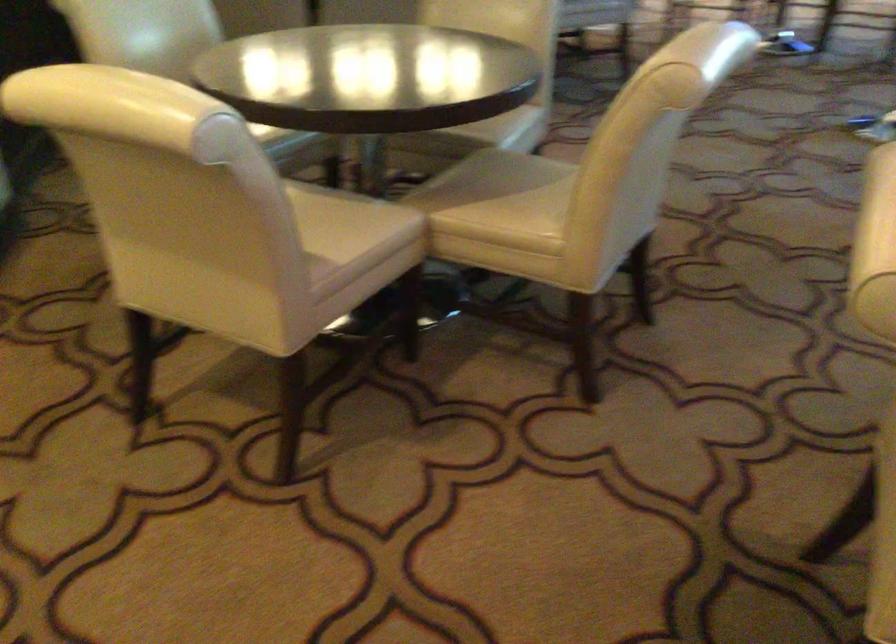
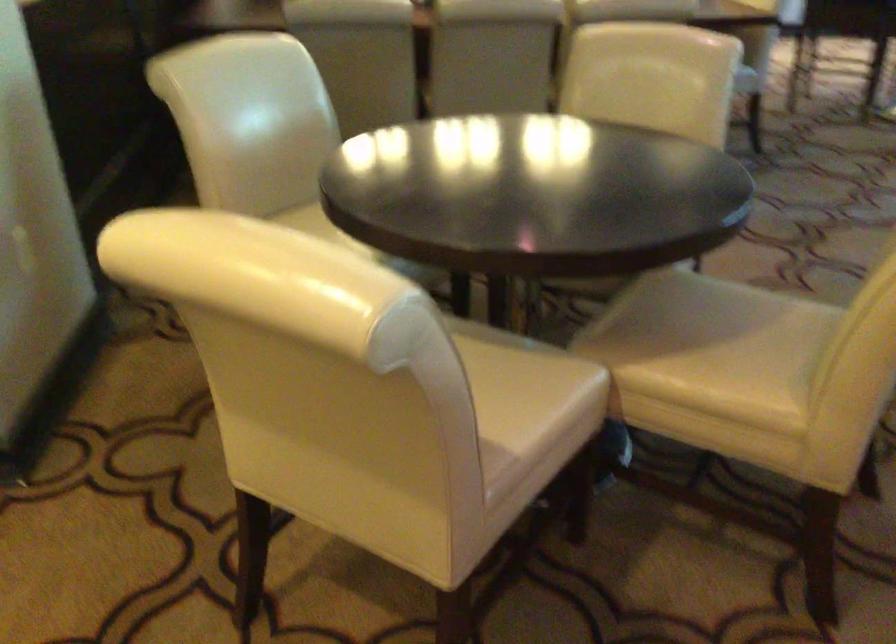
Where in the second image is the point corresponding to point (358, 218) from the first image?

(530, 377)